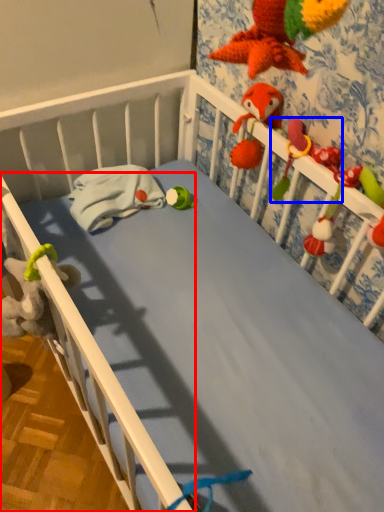
Question: Which object appears closest to the camera in this image, rail (highlighted by a red box) or parrot (highlighted by a blue box)?

Choices:
 (A) rail
 (B) parrot

Answer: (B)